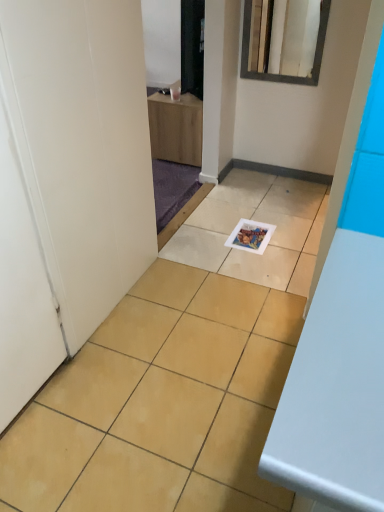
Question: Considering the relative sizes of matte paper magazine at center and white matte door at left in the image provided, is matte paper magazine at center bigger than white matte door at left?

Choices:
 (A) yes
 (B) no

Answer: (B)

Question: Can you confirm if matte paper magazine at center is thinner than white matte door at left?

Choices:
 (A) no
 (B) yes

Answer: (A)

Question: Considering the relative sizes of matte paper magazine at center and white matte door at left in the image provided, is matte paper magazine at center shorter than white matte door at left?

Choices:
 (A) no
 (B) yes

Answer: (B)

Question: Could you tell me if matte paper magazine at center is facing white matte door at left?

Choices:
 (A) yes
 (B) no

Answer: (B)

Question: Considering the relative sizes of matte paper magazine at center and white matte door at left in the image provided, is matte paper magazine at center taller than white matte door at left?

Choices:
 (A) yes
 (B) no

Answer: (B)

Question: Based on their sizes in the image, would you say white matte door at left is bigger or smaller than matte paper magazine at center?

Choices:
 (A) small
 (B) big

Answer: (B)

Question: From a real-world perspective, relative to matte paper magazine at center, is white matte door at left vertically above or below?

Choices:
 (A) below
 (B) above

Answer: (B)

Question: From the image's perspective, is white matte door at left located above or below matte paper magazine at center?

Choices:
 (A) above
 (B) below

Answer: (B)

Question: Considering their positions, is white matte door at left located in front of or behind matte paper magazine at center?

Choices:
 (A) behind
 (B) front

Answer: (B)

Question: Is point (321, 4) closer or farther from the camera than point (6, 411)?

Choices:
 (A) farther
 (B) closer

Answer: (A)

Question: Considering the positions of white glossy mirror at upper center and white matte door at left in the image, is white glossy mirror at upper center wider or thinner than white matte door at left?

Choices:
 (A) wide
 (B) thin

Answer: (B)

Question: In the image, is white glossy mirror at upper center on the left side or the right side of white matte door at left?

Choices:
 (A) right
 (B) left

Answer: (A)

Question: Looking at the image, does white glossy mirror at upper center seem bigger or smaller compared to white matte door at left?

Choices:
 (A) small
 (B) big

Answer: (A)

Question: From a real-world perspective, relative to matte paper magazine at center, is white glossy mirror at upper center vertically above or below?

Choices:
 (A) above
 (B) below

Answer: (A)

Question: From the image's perspective, is white glossy mirror at upper center positioned above or below matte paper magazine at center?

Choices:
 (A) below
 (B) above

Answer: (B)